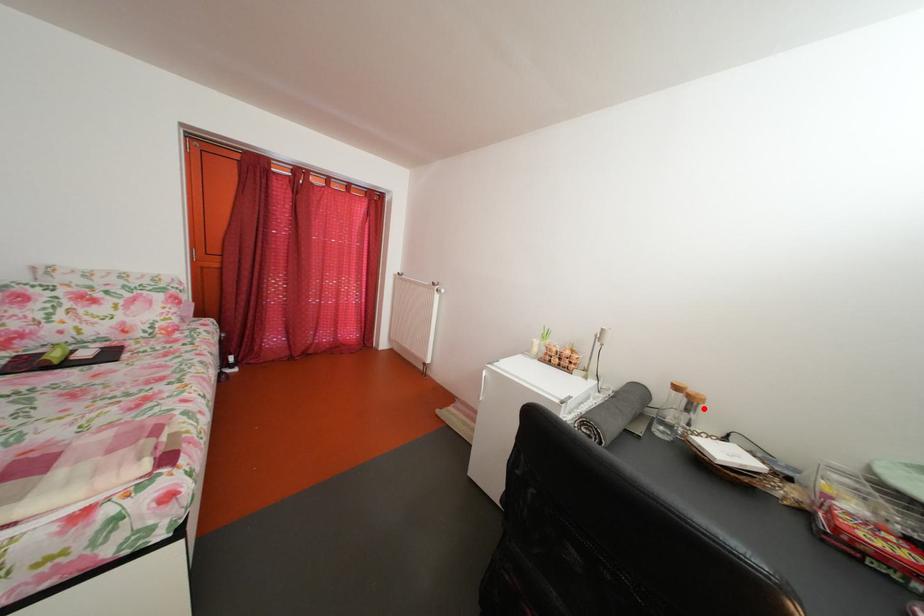
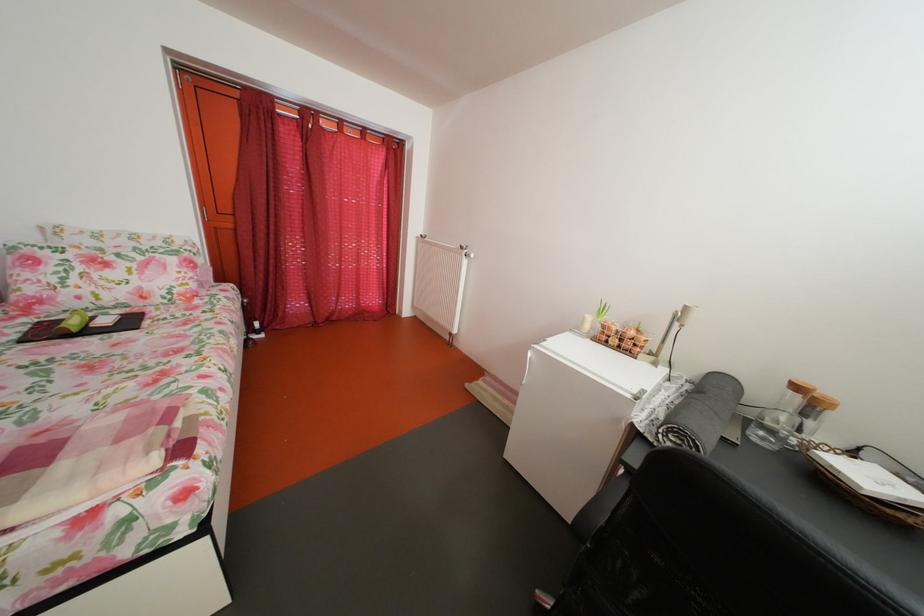
Find the pixel in the second image that matches the highlighted location in the first image.

(824, 411)